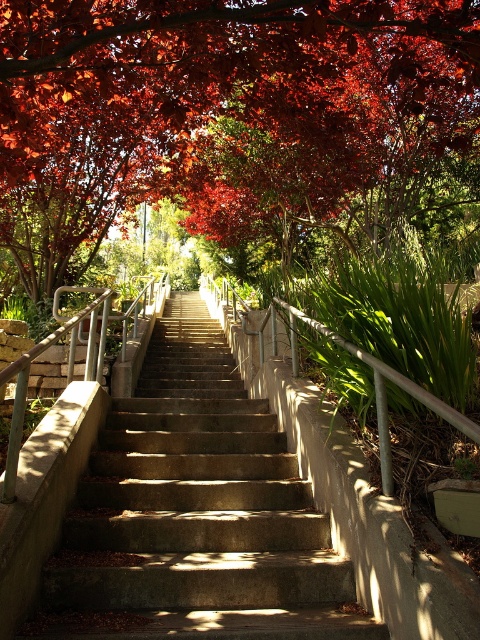
You are a hiker carrying a backpack weighing 20 kilograms. You need to climb the concrete stairs at center. There are shiny red leaves at upper center that are 15.24 feet away. Considering the incline and the distance, can you estimate if the climb will be strenuous?

The shiny red leaves at upper center are 15.24 feet away from the concrete stairs at center. Given that 15.24 feet is approximately 4.6 meters, and carrying a 20 kg backpack, the climb may be moderately strenuous depending on individual fitness levels, but the distance is manageable.

You are standing at the bottom of the concrete stairs at center and want to reach the shiny red leaves at upper center. Which direction should you move towards?

You should move to the right because the shiny red leaves at upper center are located to the right of the concrete stairs at center.